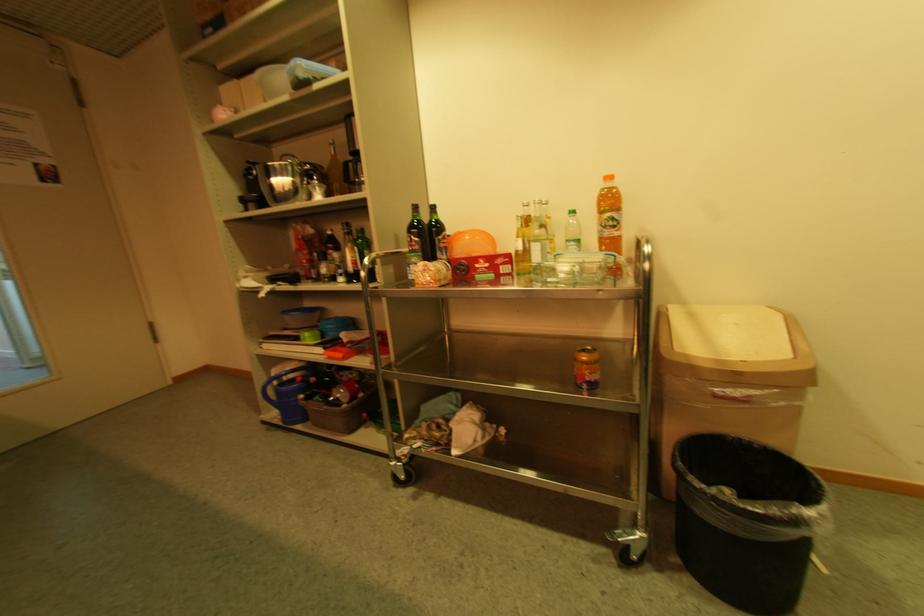
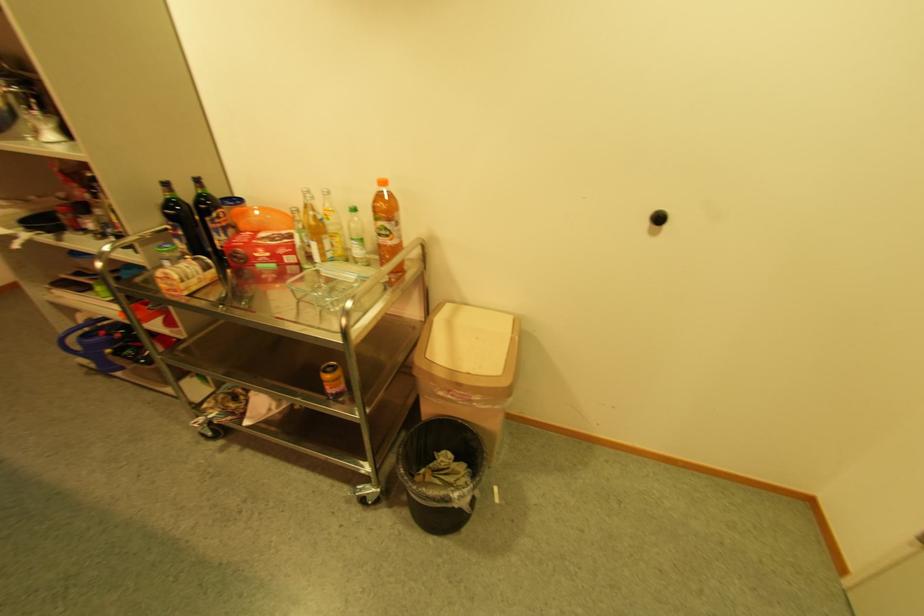
The point at (448, 256) is marked in the first image. Where is the corresponding point in the second image?

(225, 237)